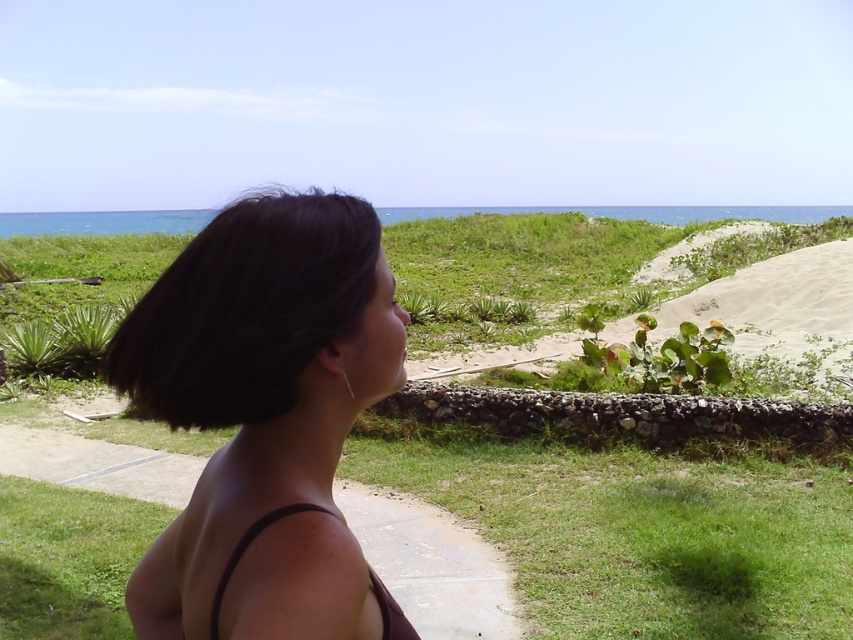
You are standing in the serene outdoor scene described. You notice a point labeled as point (265, 419) in the image. What does this point represent?

The point (265, 419) corresponds to the dark brown hair at center.